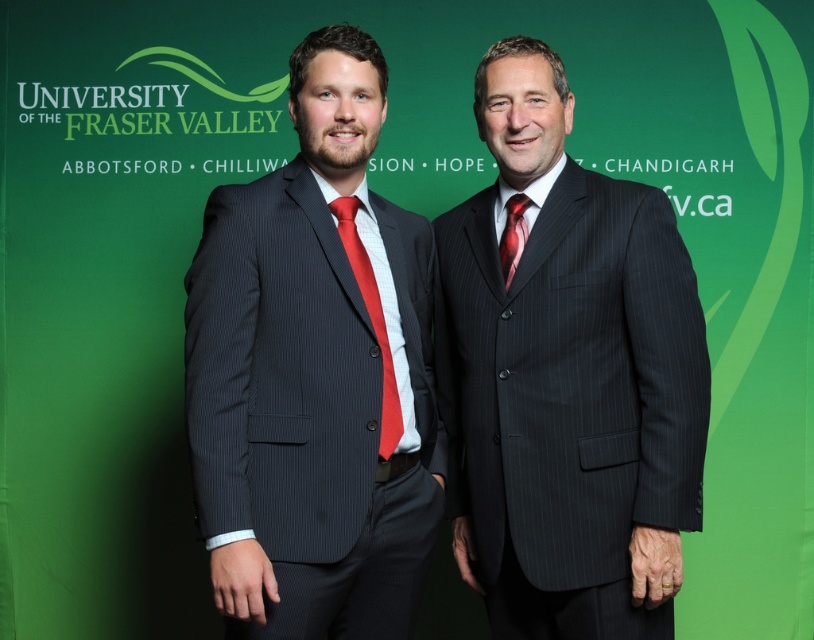
Looking at this image, who is taller, dark pinstripe suit at center or red silk tie at center?

With more height is dark pinstripe suit at center.

Is dark pinstripe suit at center behind red silk tie at center?

No, it is not.

Does point (462, 518) lie behind point (384, 417)?

Yes, point (462, 518) is farther from viewer.

Image resolution: width=814 pixels, height=640 pixels. I want to click on dark pinstripe suit at center, so click(567, 378).

Does point (502, 621) come closer to viewer compared to point (344, 372)?

No.

I want to click on dark pinstripe suit at center, so click(x=567, y=378).

Does point (578, 464) lie in front of point (305, 545)?

No, (578, 464) is further to viewer.

Locate an element on the screen. Image resolution: width=814 pixels, height=640 pixels. dark pinstripe suit at center is located at coordinates (567, 378).

Who is higher up, matte pinstripe suit at center or shiny silk tie at center?

Positioned higher is shiny silk tie at center.

Does point (234, 282) come farther from viewer compared to point (504, 285)?

No, it is in front of (504, 285).

You are a GUI agent. You are given a task and a screenshot of the screen. Output one action in this format:
    pyautogui.click(x=<x>, y=<y>)
    Task: Click on the matte pinstripe suit at center
    The image size is (814, 640).
    Given the screenshot: What is the action you would take?
    pyautogui.click(x=314, y=374)